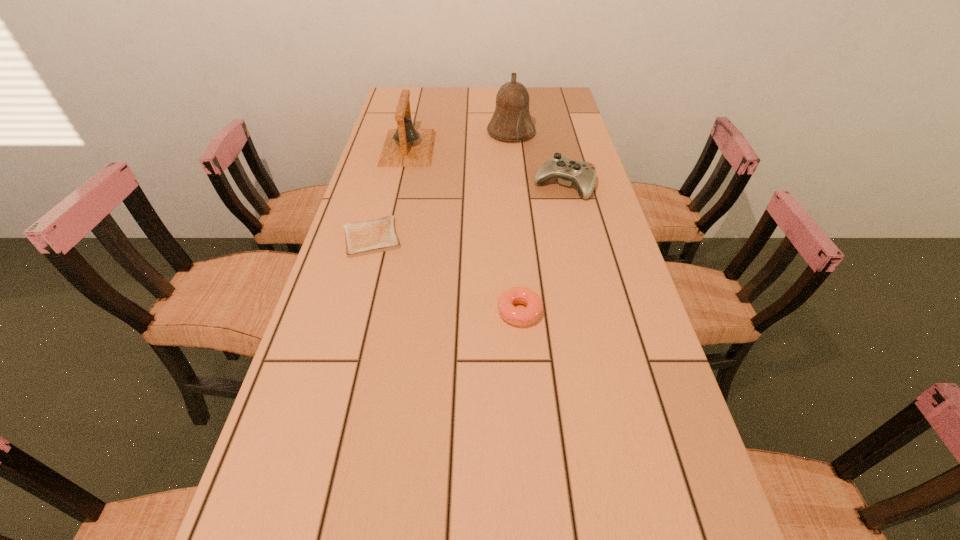
At what (x,y) coordinates should I click in order to perform the action: click on the right bell. Please return your answer as a coordinate pair (x, y). Looking at the image, I should click on [x=511, y=121].

This screenshot has width=960, height=540. Find the location of `the tallest object`. the tallest object is located at coordinates (511, 121).

At what (x,y) coordinates should I click in order to perform the action: click on the shorter bell. Please return your answer as a coordinate pair (x, y). Looking at the image, I should click on (405, 146).

Locate an element on the screen. The height and width of the screenshot is (540, 960). the fourth shortest object is located at coordinates (405, 146).

Find the location of a particular element. The height and width of the screenshot is (540, 960). control is located at coordinates (583, 174).

Find the location of a particular element. The image size is (960, 540). the third shortest object is located at coordinates (583, 174).

You are a GUI agent. You are given a task and a screenshot of the screen. Output one action in this format:
    pyautogui.click(x=<x>, y=<y>)
    Task: Click on the nearest object
    The width and height of the screenshot is (960, 540).
    Given the screenshot: What is the action you would take?
    pyautogui.click(x=516, y=316)

Locate an element on the screen. Image resolution: width=960 pixels, height=540 pixels. doughnut is located at coordinates (516, 316).

Identify the location of the fourth farthest object. The height and width of the screenshot is (540, 960). (363, 238).

Identify the location of toast. (363, 238).